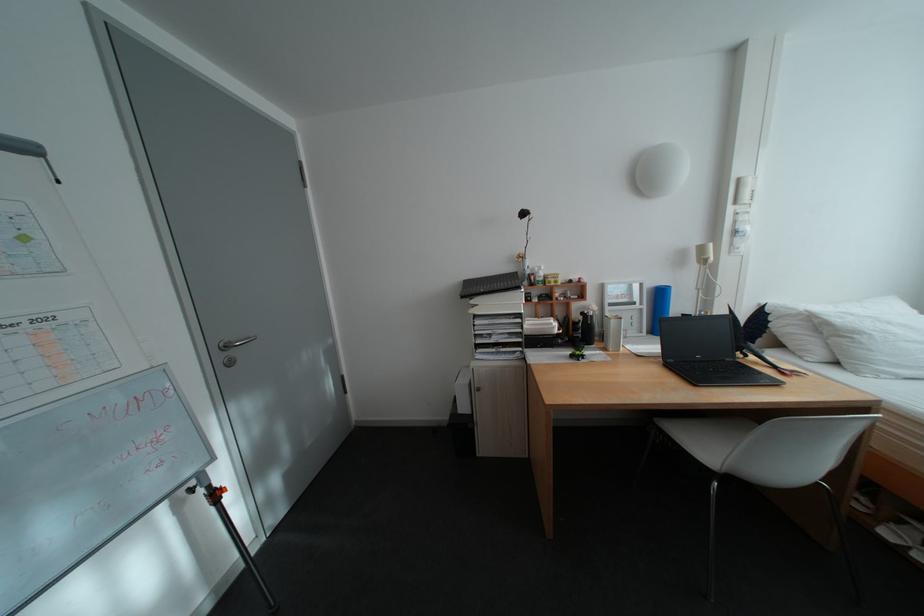
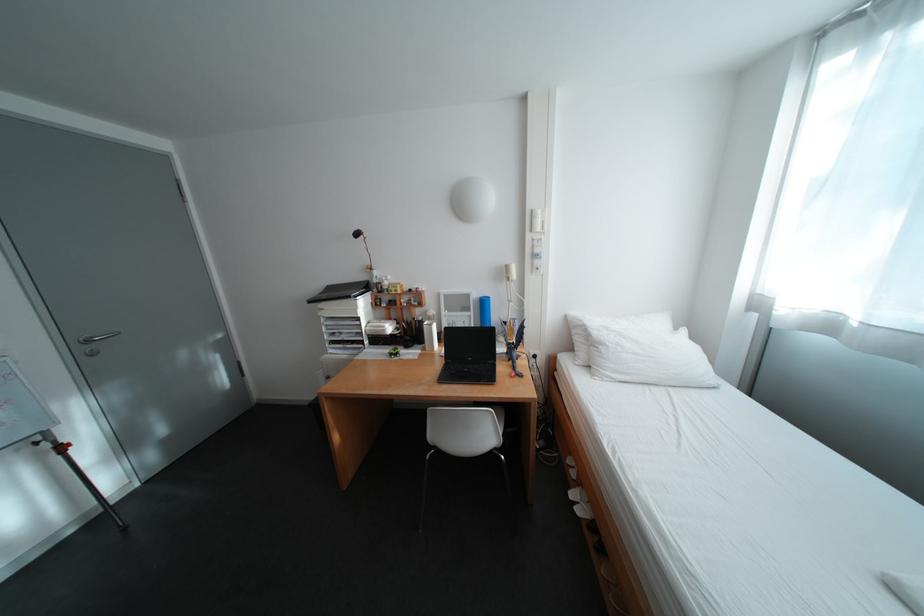
Where in the second image is the point corresponding to pixel 743 211 from the first image?

(541, 237)